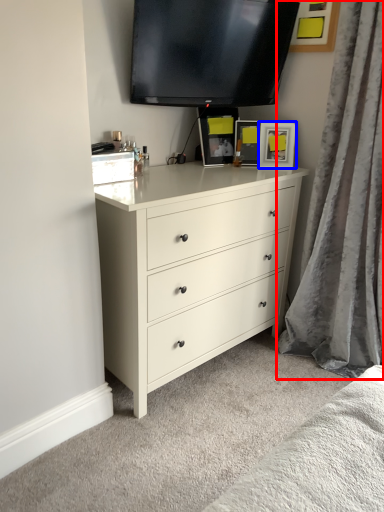
Question: Among these objects, which one is farthest to the camera, curtain (highlighted by a red box) or picture frame (highlighted by a blue box)?

Choices:
 (A) curtain
 (B) picture frame

Answer: (B)